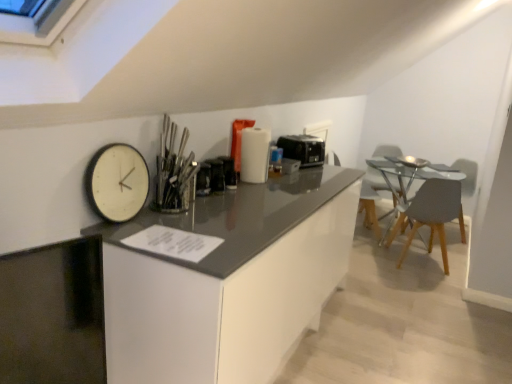
Question: Is black plastic toaster at center, the first appliance in the back-to-front sequence, further to camera compared to matte gray armchair at right?

Choices:
 (A) yes
 (B) no

Answer: (B)

Question: From the image's perspective, does black plastic toaster at center, the first appliance in the back-to-front sequence, appear lower than matte gray armchair at right?

Choices:
 (A) yes
 (B) no

Answer: (B)

Question: Considering the relative sizes of black plastic toaster at center, marked as the first appliance in a right-to-left arrangement, and matte gray armchair at right in the image provided, is black plastic toaster at center, marked as the first appliance in a right-to-left arrangement, wider than matte gray armchair at right?

Choices:
 (A) no
 (B) yes

Answer: (A)

Question: Can you see black plastic toaster at center, which is the second appliance from left to right, touching matte gray armchair at right?

Choices:
 (A) yes
 (B) no

Answer: (B)

Question: From a real-world perspective, is black plastic toaster at center, marked as the first appliance in a right-to-left arrangement, over matte gray armchair at right?

Choices:
 (A) yes
 (B) no

Answer: (A)

Question: Is polished metal utensils at center taller or shorter than light gray wood chair at right, which is counted as the 2th chair, starting from the right?

Choices:
 (A) tall
 (B) short

Answer: (B)

Question: From a real-world perspective, is polished metal utensils at center above or below light gray wood chair at right, which is counted as the 2th chair, starting from the right?

Choices:
 (A) below
 (B) above

Answer: (B)

Question: Would you say polished metal utensils at center is inside or outside light gray wood chair at right, which is counted as the 2th chair, starting from the right?

Choices:
 (A) inside
 (B) outside

Answer: (B)

Question: Is point (162, 127) positioned closer to the camera than point (368, 198)?

Choices:
 (A) farther
 (B) closer

Answer: (B)

Question: Visually, is white glossy cabinetry at center positioned to the left or to the right of light gray wood chair at right, which is counted as the 2th chair, starting from the right?

Choices:
 (A) right
 (B) left

Answer: (B)

Question: Is white glossy cabinetry at center bigger or smaller than light gray wood chair at right, the 1th chair positioned from the left?

Choices:
 (A) big
 (B) small

Answer: (A)

Question: Does point [184, 339] appear closer or farther from the camera than point [358, 203]?

Choices:
 (A) closer
 (B) farther

Answer: (A)

Question: Is white glossy cabinetry at center situated inside light gray wood chair at right, the 1th chair positioned from the left, or outside?

Choices:
 (A) outside
 (B) inside

Answer: (A)

Question: Considering the positions of point (453, 213) and point (376, 173), is point (453, 213) closer or farther from the camera than point (376, 173)?

Choices:
 (A) farther
 (B) closer

Answer: (B)

Question: From the image's perspective, is matte gray chair at right, which is counted as the 1th chair, starting from the right, above or below white plastic swivel chair at right?

Choices:
 (A) below
 (B) above

Answer: (A)